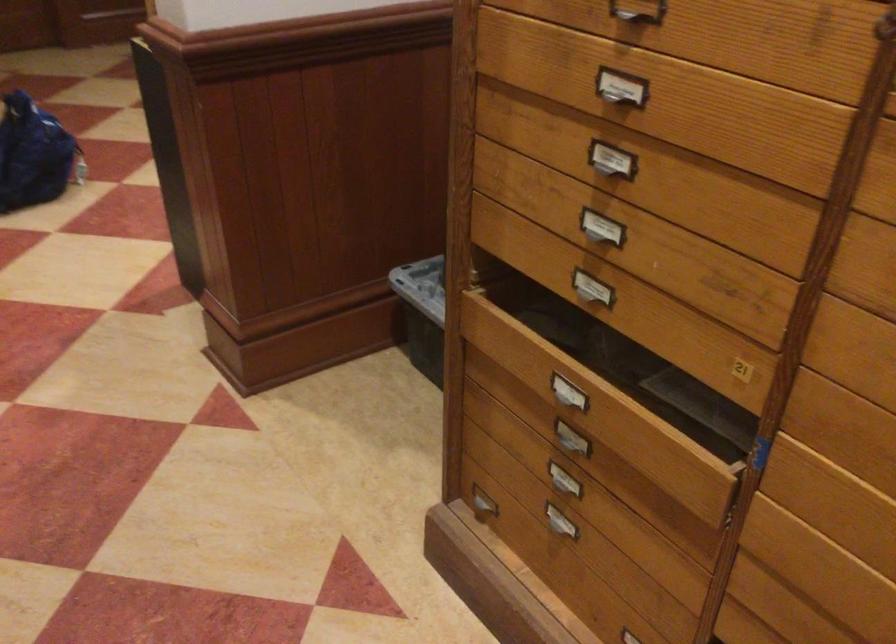
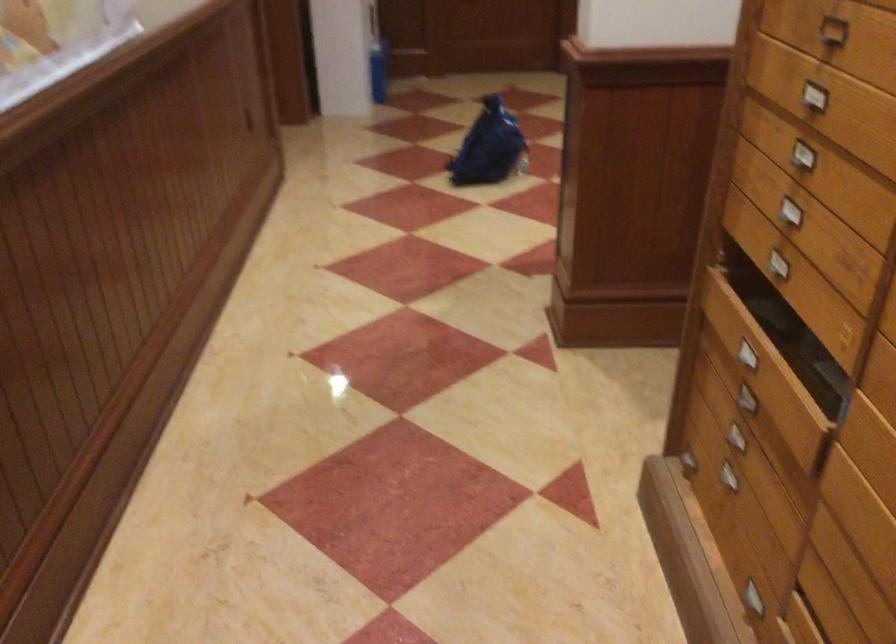
Question: The camera is either moving clockwise (left) or counter-clockwise (right) around the object. The first image is from the beginning of the video and the second image is from the end. Is the camera moving left or right when shooting the video?

Choices:
 (A) Left
 (B) Right

Answer: (B)